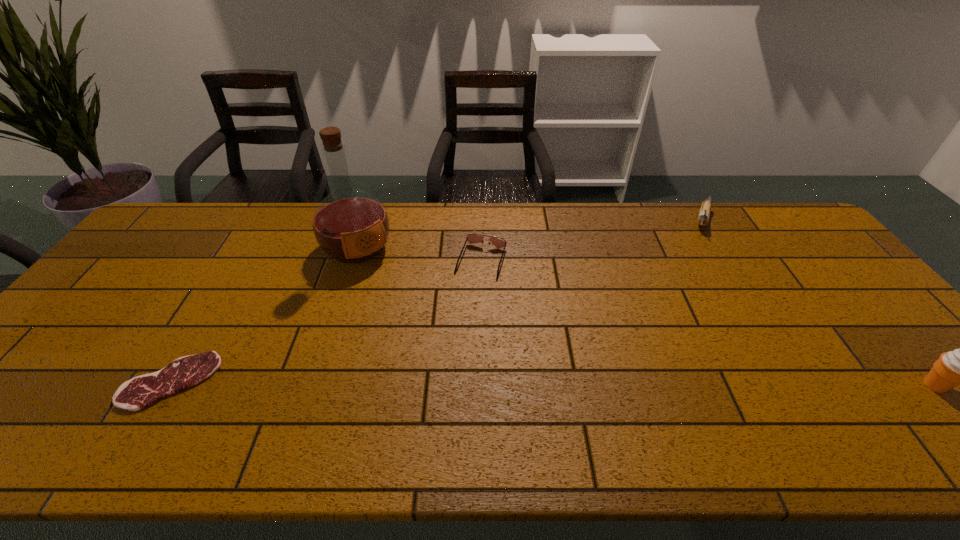
Find the location of a particular element. The width and height of the screenshot is (960, 540). free location located 0.090m on the front label of the liquor is located at coordinates (387, 285).

At what (x,y) coordinates should I click in order to perform the action: click on free space located 0.050m on the front label of the liquor. Please return your answer as a coordinate pair (x, y). This screenshot has height=540, width=960. Looking at the image, I should click on (380, 278).

Locate an element on the screen. The image size is (960, 540). vacant region located 0.350m on the bridge of the fourth tallest object is located at coordinates (440, 381).

Locate an element on the screen. This screenshot has width=960, height=540. vacant space positioned 0.150m on the bridge of the fourth tallest object is located at coordinates (462, 319).

You are a GUI agent. You are given a task and a screenshot of the screen. Output one action in this format:
    pyautogui.click(x=<x>, y=<y>)
    Task: Click on the free location located 0.310m on the bridge of the fourth tallest object
    The height and width of the screenshot is (540, 960).
    Given the screenshot: What is the action you would take?
    pyautogui.click(x=444, y=367)

Identify the location of free region located 0.200m on the peel of the banana. The height and width of the screenshot is (540, 960). (692, 267).

The width and height of the screenshot is (960, 540). I want to click on vacant space situated on the peel of the banana, so click(x=686, y=292).

At what (x,y) coordinates should I click in order to perform the action: click on vacant space situated 0.230m on the peel of the banana. Please return your answer as a coordinate pair (x, y). The height and width of the screenshot is (540, 960). Looking at the image, I should click on (691, 273).

Find the location of `liquor located at the far edge`. liquor located at the far edge is located at coordinates (350, 225).

I want to click on sunglasses at the far edge, so click(471, 238).